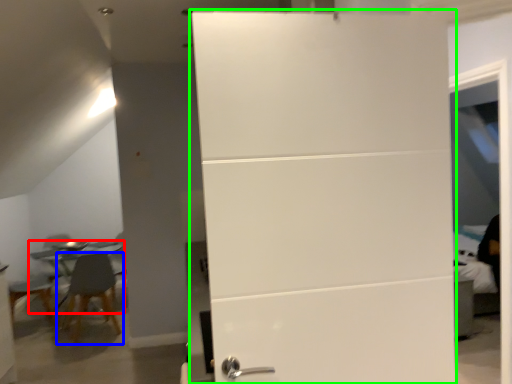
Question: Considering the real-world distances, which object is farthest from table (highlighted by a red box)? chair (highlighted by a blue box) or door (highlighted by a green box)?

Choices:
 (A) chair
 (B) door

Answer: (B)